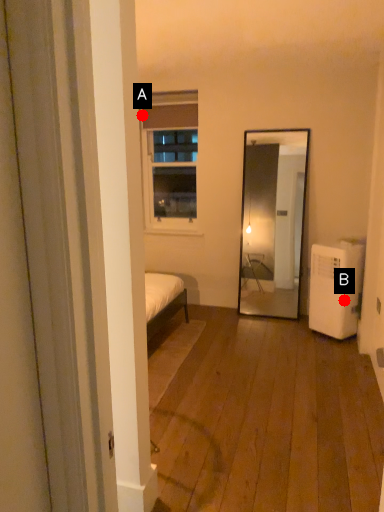
Question: Two points are circled on the image, labeled by A and B beside each circle. Which point appears closest to the camera in this image?

Choices:
 (A) A is closer
 (B) B is closer

Answer: (B)